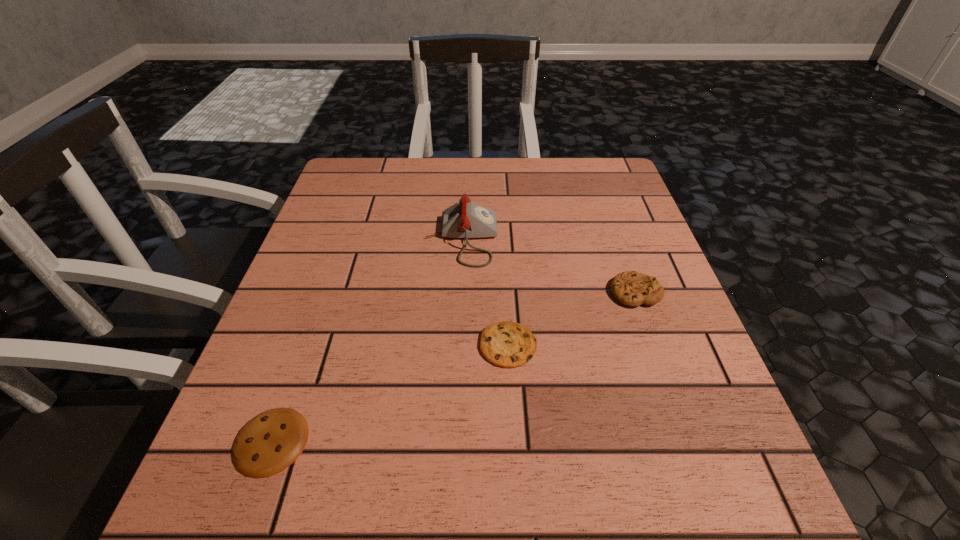
Locate an element on the screen. This screenshot has width=960, height=540. free space at the far left corner of the desktop is located at coordinates (380, 179).

Where is `vacant space at the near left corner of the desktop`? Image resolution: width=960 pixels, height=540 pixels. vacant space at the near left corner of the desktop is located at coordinates (241, 514).

In the image, there is a desktop. Identify the location of free space at the far right corner. (620, 198).

The width and height of the screenshot is (960, 540). I want to click on blank space at the near right corner, so click(641, 483).

This screenshot has width=960, height=540. Find the location of `blank region between the second cookie from right to left and the leftmost cookie`. blank region between the second cookie from right to left and the leftmost cookie is located at coordinates (390, 393).

Where is `empty space between the nearest object and the second farthest cookie`? empty space between the nearest object and the second farthest cookie is located at coordinates (390, 393).

Where is `free space between the second nearest cookie and the tallest object`? Image resolution: width=960 pixels, height=540 pixels. free space between the second nearest cookie and the tallest object is located at coordinates (485, 292).

Locate an element on the screen. empty space that is in between the telephone and the rightmost object is located at coordinates (549, 265).

You are a GUI agent. You are given a task and a screenshot of the screen. Output one action in this format:
    pyautogui.click(x=<x>, y=<y>)
    Task: Click on the vacant space that is in between the nearest cookie and the second farthest object
    This screenshot has height=540, width=960.
    Given the screenshot: What is the action you would take?
    pyautogui.click(x=453, y=367)

Find the location of a particular element. The width and height of the screenshot is (960, 540). free space between the telephone and the nearest cookie is located at coordinates (367, 340).